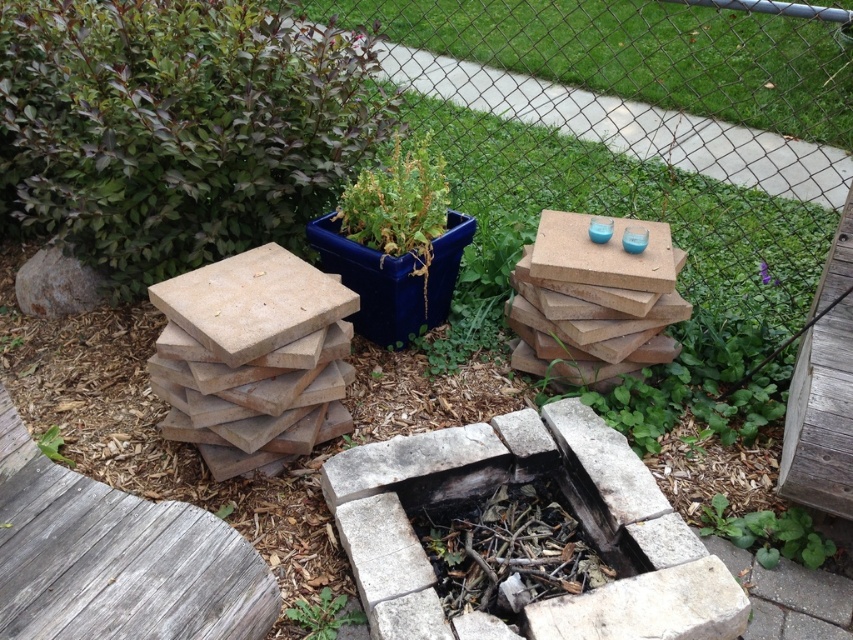
Question: Which point is farther to the camera?

Choices:
 (A) blue ceramic planter at center
 (B) green leafy plant at lower left
 (C) green matte plant at left

Answer: (A)

Question: Among these points, which one is nearest to the camera?

Choices:
 (A) (418, 285)
 (B) (47, 124)

Answer: (B)

Question: Can you confirm if green matte plant at left is bigger than blue ceramic planter at center?

Choices:
 (A) no
 (B) yes

Answer: (B)

Question: From the image, what is the correct spatial relationship of blue ceramic planter at center in relation to green leafy plant at lower center?

Choices:
 (A) right
 (B) left

Answer: (A)

Question: Which of the following is the farthest from the observer?

Choices:
 (A) (728, 516)
 (B) (57, 428)
 (C) (228, 506)
 (D) (415, 262)

Answer: (D)

Question: Is green matte plant at left further to camera compared to green leafy plant at lower right?

Choices:
 (A) yes
 (B) no

Answer: (A)